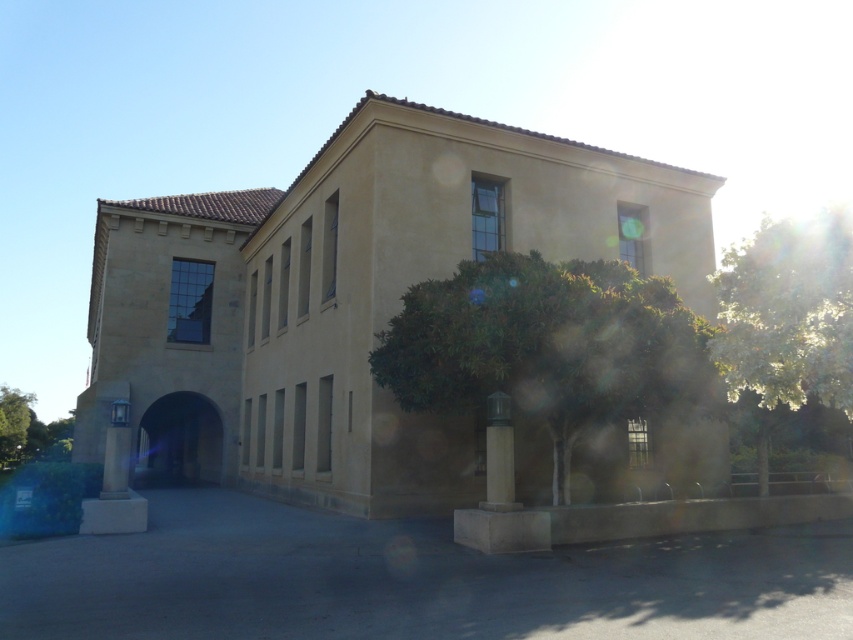
You are standing in front of the two story beige stone building with a terracotta tile roof. You notice a green leafy tree at right. Based on the coordinates provided, can you determine if the tree is positioned to the left or right side of the building?

The green leafy tree at right is located at point (787, 317), which places it on the right side of the building as per the coordinate system. Therefore, the tree is positioned to the right side of the building.